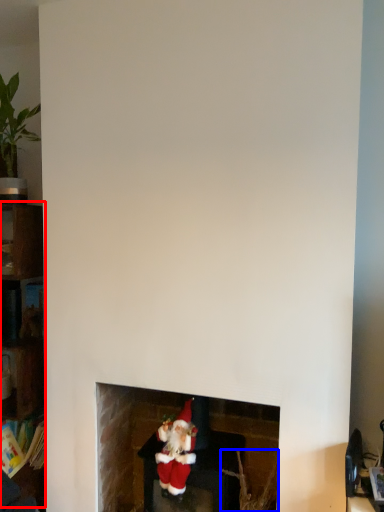
Question: Among these objects, which one is nearest to the camera, shelf (highlighted by a red box) or plant (highlighted by a blue box)?

Choices:
 (A) shelf
 (B) plant

Answer: (B)